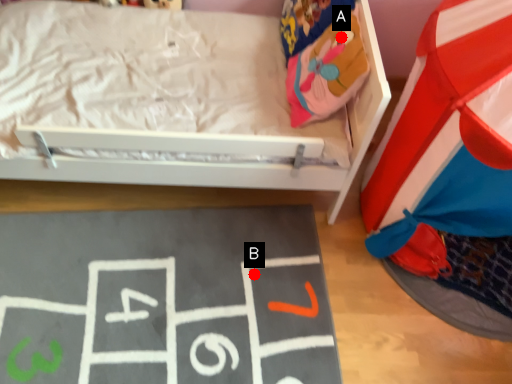
Question: Two points are circled on the image, labeled by A and B beside each circle. Which of the following is the farthest from the observer?

Choices:
 (A) A is further
 (B) B is further

Answer: (B)